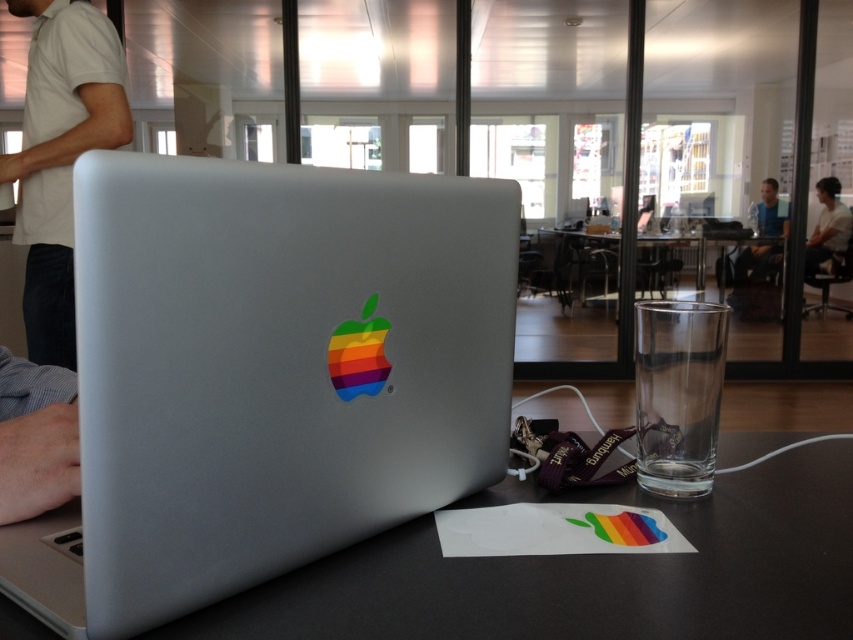
Who is positioned more to the right, black matte table at center or white cotton shirt at upper left?

From the viewer's perspective, black matte table at center appears more on the right side.

Can you confirm if black matte table at center is positioned above white cotton shirt at upper left?

Actually, black matte table at center is below white cotton shirt at upper left.

Find the location of a particular element. black matte table at center is located at coordinates (585, 572).

Which of these two, black matte table at center or white shirt at upper right, stands shorter?

Standing shorter between the two is black matte table at center.

Who is taller, black matte table at center or white shirt at upper right?

white shirt at upper right is taller.

The image size is (853, 640). I want to click on black matte table at center, so click(x=585, y=572).

Find the location of a particular element. The width and height of the screenshot is (853, 640). black matte table at center is located at coordinates (585, 572).

The image size is (853, 640). Find the location of `satin silver laptop at center`. satin silver laptop at center is located at coordinates (265, 376).

Between satin silver laptop at center and white shirt at upper right, which one appears on the left side from the viewer's perspective?

From the viewer's perspective, satin silver laptop at center appears more on the left side.

What do you see at coordinates (265, 376) in the screenshot? This screenshot has width=853, height=640. I see `satin silver laptop at center` at bounding box center [265, 376].

This screenshot has height=640, width=853. I want to click on satin silver laptop at center, so click(x=265, y=376).